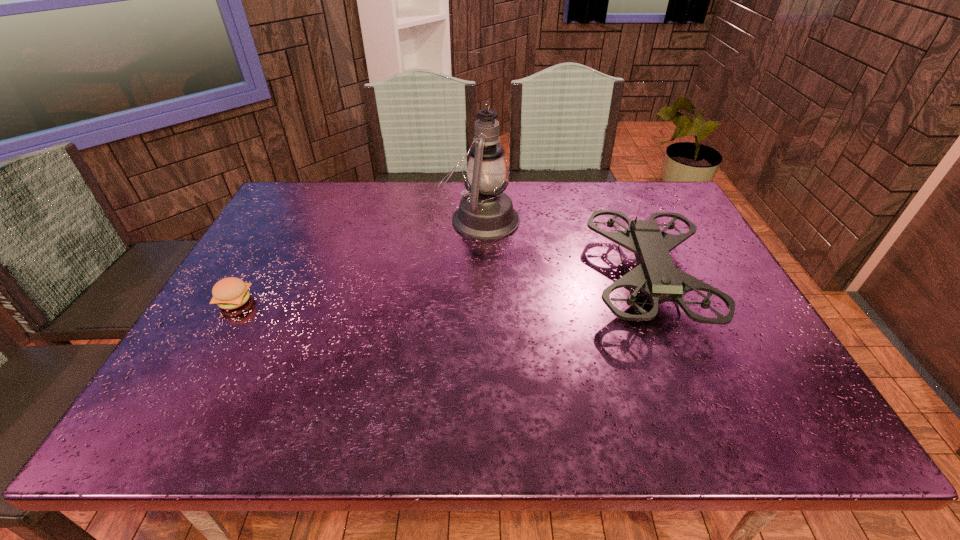
Image resolution: width=960 pixels, height=540 pixels. In order to click on object at the left edge in this screenshot , I will do `click(229, 293)`.

Where is `object situated at the right edge`? The width and height of the screenshot is (960, 540). object situated at the right edge is located at coordinates (656, 276).

This screenshot has height=540, width=960. I want to click on free space at the far edge, so click(x=371, y=184).

In the image, there is a desktop. At what (x,y) coordinates should I click in order to perform the action: click on free space at the near edge. Please return your answer as a coordinate pair (x, y). The width and height of the screenshot is (960, 540). Looking at the image, I should click on (551, 415).

The width and height of the screenshot is (960, 540). I want to click on free space at the left edge of the desktop, so click(x=239, y=336).

You are a GUI agent. You are given a task and a screenshot of the screen. Output one action in this format:
    pyautogui.click(x=<x>, y=<y>)
    Task: Click on the free space at the far left corner of the desktop
    Image resolution: width=960 pixels, height=540 pixels.
    Given the screenshot: What is the action you would take?
    pyautogui.click(x=297, y=188)

You are a GUI agent. You are given a task and a screenshot of the screen. Output one action in this format:
    pyautogui.click(x=<x>, y=<y>)
    Task: Click on the free space at the far right corner of the desktop
    The width and height of the screenshot is (960, 540).
    Given the screenshot: What is the action you would take?
    pyautogui.click(x=668, y=196)

You are a GUI agent. You are given a task and a screenshot of the screen. Output one action in this format:
    pyautogui.click(x=<x>, y=<y>)
    Task: Click on the vacant position at the near right corner of the desktop
    
    Given the screenshot: What is the action you would take?
    pyautogui.click(x=736, y=420)

You are a GUI agent. You are given a task and a screenshot of the screen. Output one action in this format:
    pyautogui.click(x=<x>, y=<y>)
    Task: Click on the free space that is in between the shortest object and the second object from left to right
    Image resolution: width=960 pixels, height=540 pixels.
    Given the screenshot: What is the action you would take?
    pyautogui.click(x=357, y=260)

Locate an element on the screen. free point between the hamburger and the drone is located at coordinates (441, 290).